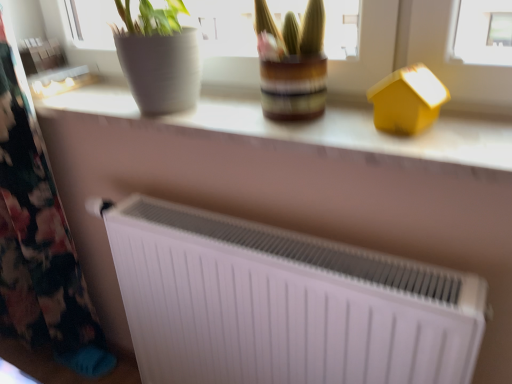
Question: Relative to white matte radiator at lower center, is floral fabric at left in front or behind?

Choices:
 (A) behind
 (B) front

Answer: (A)

Question: From a real-world perspective, relative to white matte radiator at lower center, is floral fabric at left vertically above or below?

Choices:
 (A) below
 (B) above

Answer: (B)

Question: Estimate the real-world distances between objects in this image. Which object is closer to the matte white radiator at center?

Choices:
 (A) white matte radiator at center
 (B) floral fabric at left
 (C) white matte radiator at lower center
 (D) yellow matte house at upper right

Answer: (D)

Question: Which is nearer to the white matte radiator at lower center?

Choices:
 (A) matte white radiator at center
 (B) yellow matte house at upper right
 (C) floral fabric at left
 (D) white matte radiator at center

Answer: (D)